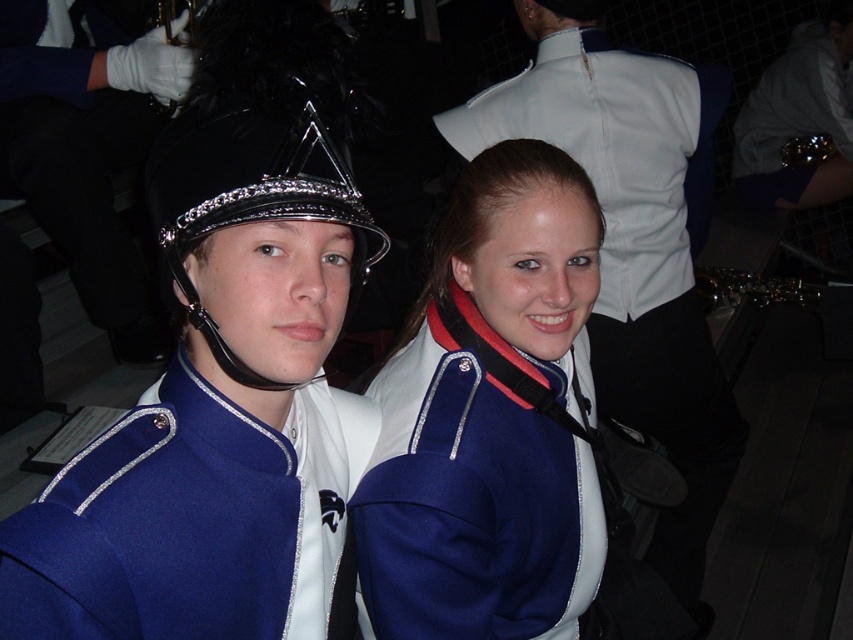
Which is below, blue wool jacket at left or shiny black helmet at center?

blue wool jacket at left

Between point (42, 556) and point (355, 188), which one is positioned behind?

The point (355, 188) is behind.

Is point (164, 541) more distant than point (200, 150)?

Yes, point (164, 541) is farther from viewer.

Where is `blue wool jacket at left`? blue wool jacket at left is located at coordinates (192, 524).

Consider the image. Between blue woolen jacket at center and metallic gold saxophone at lower right, which one appears on the left side from the viewer's perspective?

From the viewer's perspective, blue woolen jacket at center appears more on the left side.

Based on the photo, does blue woolen jacket at center have a greater height compared to metallic gold saxophone at lower right?

No, blue woolen jacket at center is not taller than metallic gold saxophone at lower right.

At what (x,y) coordinates should I click in order to perform the action: click on blue woolen jacket at center. Please return your answer as a coordinate pair (x, y). Looking at the image, I should click on (488, 420).

Which is below, blue woolen jacket at center or shiny black helmet at center?

blue woolen jacket at center

Is blue woolen jacket at center to the right of shiny black helmet at center from the viewer's perspective?

Indeed, blue woolen jacket at center is positioned on the right side of shiny black helmet at center.

Is point (547, 179) positioned after point (317, 115)?

Yes, it is behind point (317, 115).

This screenshot has width=853, height=640. In order to click on blue woolen jacket at center in this screenshot , I will do `click(488, 420)`.